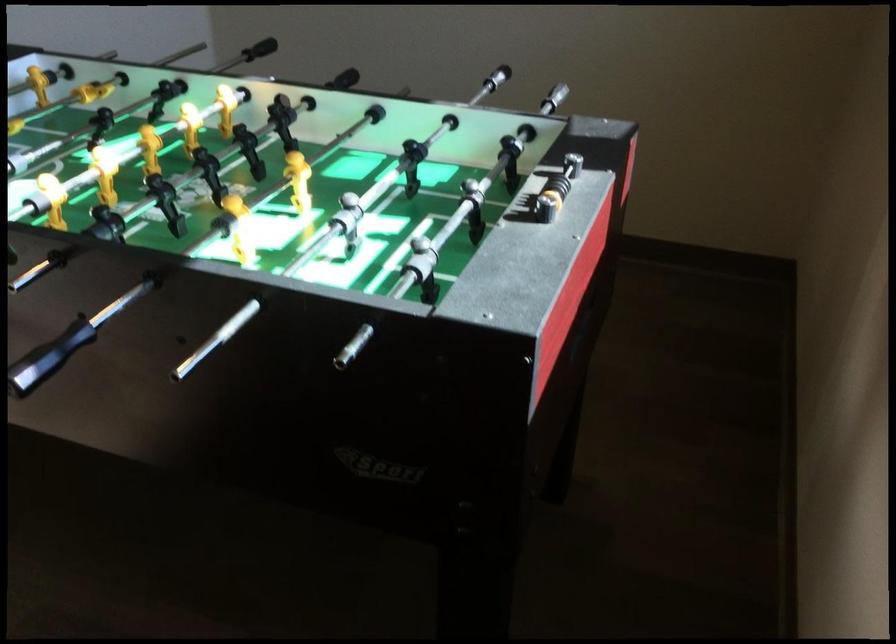
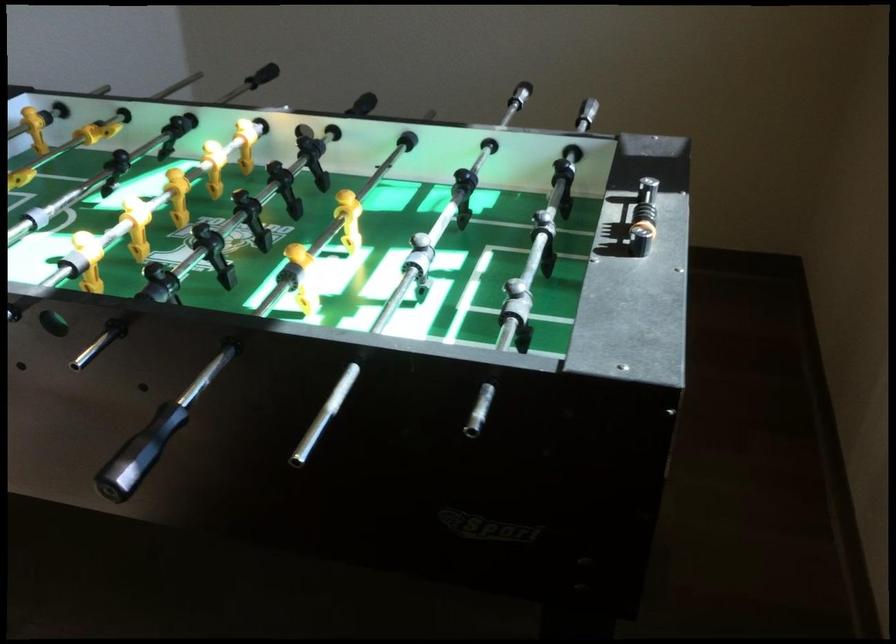
Question: The first image is from the beginning of the video and the second image is from the end. How did the camera likely rotate when shooting the video?

Choices:
 (A) Left
 (B) Right
 (C) Up
 (D) Down

Answer: (B)